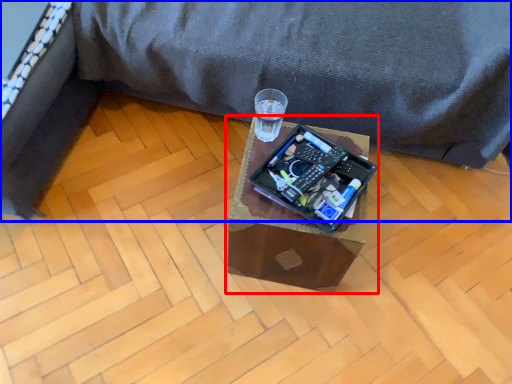
Question: Which point is further to the camera, table (highlighted by a red box) or furniture (highlighted by a blue box)?

Choices:
 (A) table
 (B) furniture

Answer: (A)